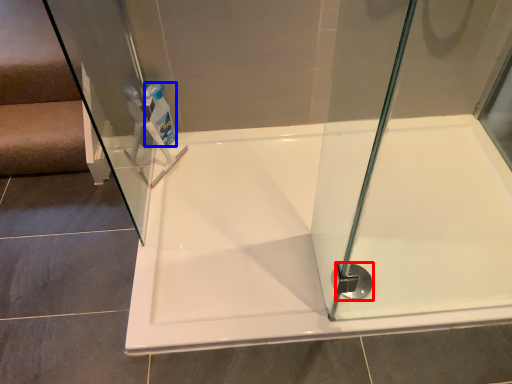
Question: Which object appears closest to the camera in this image, shower (highlighted by a red box) or cleaning product (highlighted by a blue box)?

Choices:
 (A) shower
 (B) cleaning product

Answer: (A)